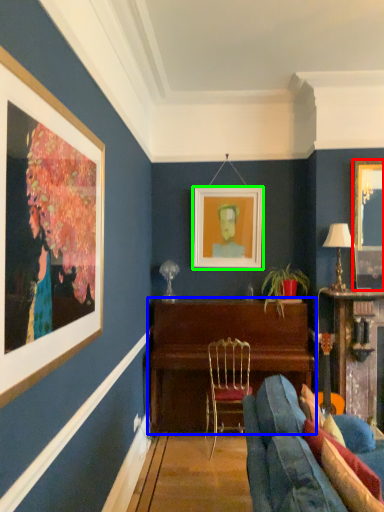
Question: Which object is the farthest from picture frame (highlighted by a red box)? Choose among these: table (highlighted by a blue box) or picture frame (highlighted by a green box).

Choices:
 (A) table
 (B) picture frame

Answer: (A)